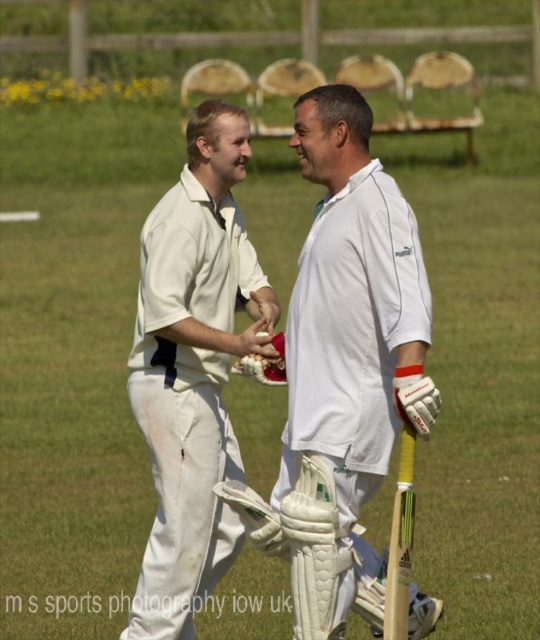
Is white matte cricket bat at center further to camera compared to white leather baseball glove at center?

No, it is not.

Can you confirm if white matte cricket bat at center is wider than white leather baseball glove at center?

Yes, white matte cricket bat at center is wider than white leather baseball glove at center.

Who is more forward, [420,412] or [258,378]?

Positioned in front is point [420,412].

Identify the location of white matte cricket bat at center. (347, 353).

Who is taller, white matte cricket bat at center or white cloth shirt at center?

white cloth shirt at center

Which is in front, point (308, 496) or point (160, 232)?

Point (308, 496) is more forward.

Find the location of a particular element. The height and width of the screenshot is (640, 540). white matte cricket bat at center is located at coordinates (347, 353).

Between white cloth shirt at center and white leather baseball glove at center, which one is positioned lower?

white cloth shirt at center is below.

Which of these two, white cloth shirt at center or white leather baseball glove at center, stands taller?

Standing taller between the two is white cloth shirt at center.

Who is more forward, (x=137, y=348) or (x=259, y=371)?

Point (x=259, y=371) is in front.

Identify the location of white cloth shirt at center. The image size is (540, 640). (192, 369).